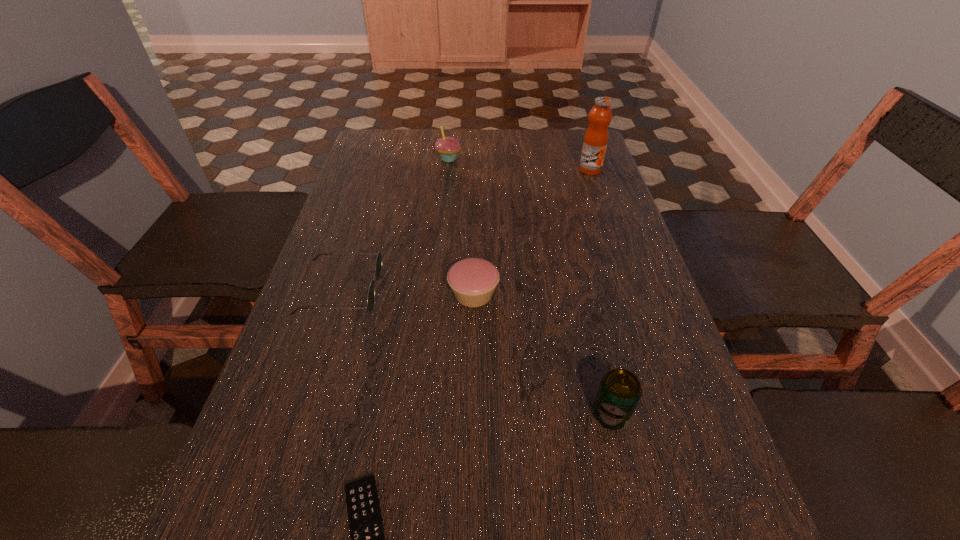
At what (x,y) coordinates should I click in order to perform the action: click on free space located 0.180m on the front label of the fruit juice. Please return your answer as a coordinate pair (x, y). The image size is (960, 540). Looking at the image, I should click on (605, 212).

This screenshot has width=960, height=540. Find the location of `blank area located 0.160m on the back of the farther cupcake`. blank area located 0.160m on the back of the farther cupcake is located at coordinates (452, 129).

What are the coordinates of `blank area located on the front of the third tallest object` in the screenshot? It's located at (630, 496).

Locate an element on the screen. The width and height of the screenshot is (960, 540). free space located 0.280m on the left of the shorter cupcake is located at coordinates (318, 294).

I want to click on free space located 0.050m on the front-facing side of the fifth tallest object, so click(401, 291).

What are the coordinates of `fruit juice that is at the far edge` in the screenshot? It's located at (595, 142).

This screenshot has height=540, width=960. What are the coordinates of `cupcake that is at the far edge` in the screenshot? It's located at pyautogui.click(x=448, y=147).

You are a GUI agent. You are given a task and a screenshot of the screen. Output one action in this format:
    pyautogui.click(x=<x>, y=<y>)
    Task: Click on the object that is positioned at the left edge
    This screenshot has height=540, width=960.
    Given the screenshot: What is the action you would take?
    (378, 265)

Where is `fruit juice present at the right edge`? This screenshot has width=960, height=540. fruit juice present at the right edge is located at coordinates (595, 142).

At what (x,y) coordinates should I click in order to perform the action: click on beer can that is at the right edge. Please return your answer as a coordinate pair (x, y). The image size is (960, 540). Looking at the image, I should click on point(619,392).